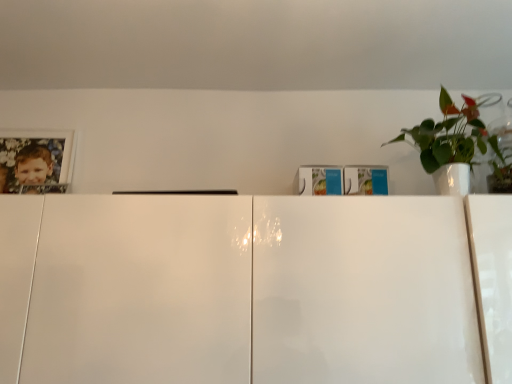
Question: Is white glossy picture frame at upper left at the left side of white glossy pot at upper right?

Choices:
 (A) no
 (B) yes

Answer: (B)

Question: From a real-world perspective, is white glossy picture frame at upper left on white glossy pot at upper right?

Choices:
 (A) no
 (B) yes

Answer: (B)

Question: Is white glossy picture frame at upper left bigger than white glossy pot at upper right?

Choices:
 (A) yes
 (B) no

Answer: (B)

Question: Is white glossy pot at upper right a part of white glossy picture frame at upper left?

Choices:
 (A) yes
 (B) no

Answer: (B)

Question: From a real-world perspective, does white glossy picture frame at upper left sit lower than white glossy pot at upper right?

Choices:
 (A) yes
 (B) no

Answer: (B)

Question: Is white glossy picture frame at upper left not close to white glossy pot at upper right?

Choices:
 (A) no
 (B) yes

Answer: (B)

Question: Is white glossy pot at upper right thinner than white glossy picture frame at upper left?

Choices:
 (A) no
 (B) yes

Answer: (A)

Question: Does white glossy pot at upper right have a greater height compared to white glossy picture frame at upper left?

Choices:
 (A) yes
 (B) no

Answer: (B)

Question: Does white glossy pot at upper right appear on the right side of white glossy picture frame at upper left?

Choices:
 (A) yes
 (B) no

Answer: (A)

Question: From a real-world perspective, is white glossy pot at upper right physically below white glossy picture frame at upper left?

Choices:
 (A) yes
 (B) no

Answer: (A)

Question: From the image's perspective, does white glossy pot at upper right appear lower than white glossy picture frame at upper left?

Choices:
 (A) yes
 (B) no

Answer: (B)

Question: Is white glossy pot at upper right positioned before white glossy picture frame at upper left?

Choices:
 (A) no
 (B) yes

Answer: (B)

Question: In terms of width, does white glossy picture frame at upper left look wider or thinner when compared to white glossy pot at upper right?

Choices:
 (A) wide
 (B) thin

Answer: (B)